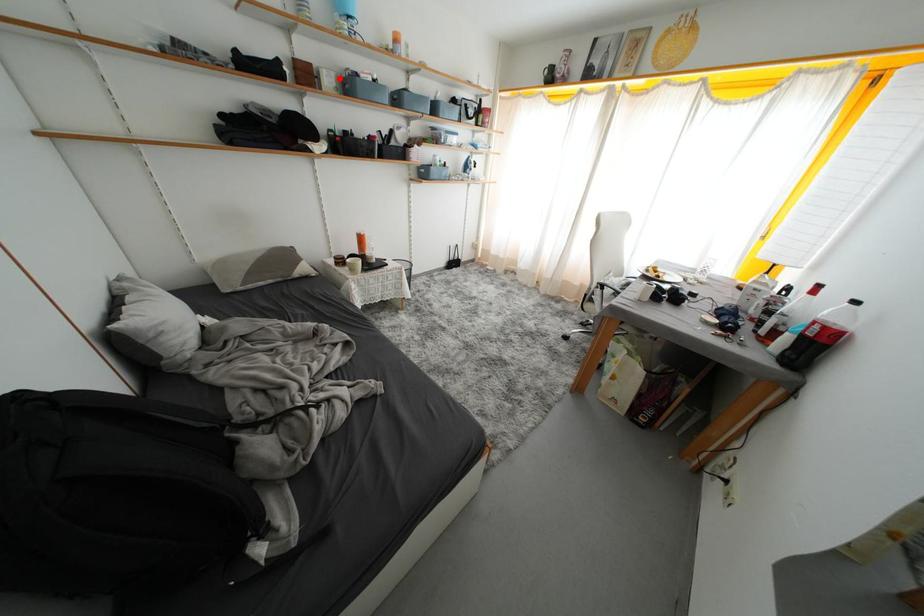
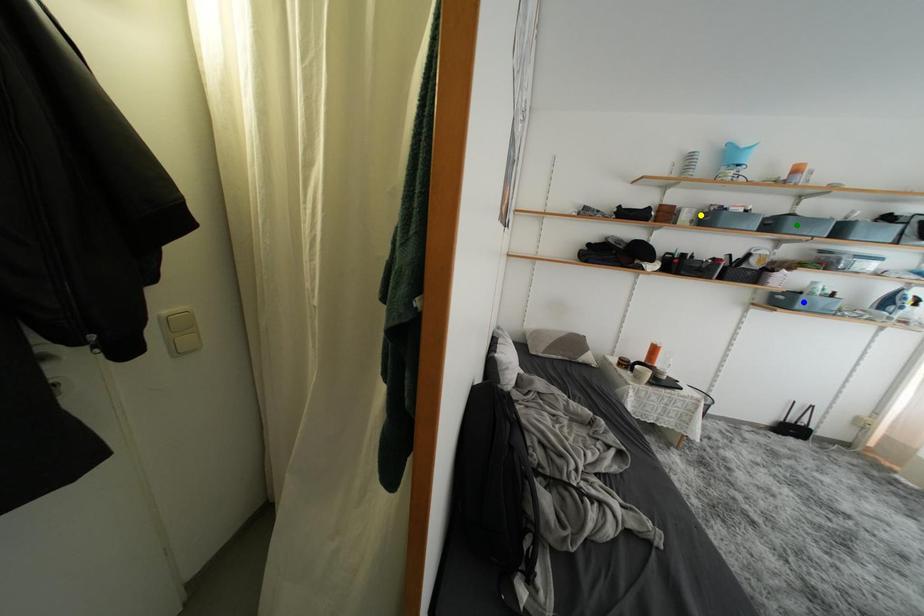
Question: I am providing you with two images of the same scene from different viewpoints. A red point is marked on the first image. You are given multiple points on the second image. Which spot in image 2 lines up with the point in image 1?

Choices:
 (A) blue point
 (B) yellow point
 (C) green point

Answer: (B)